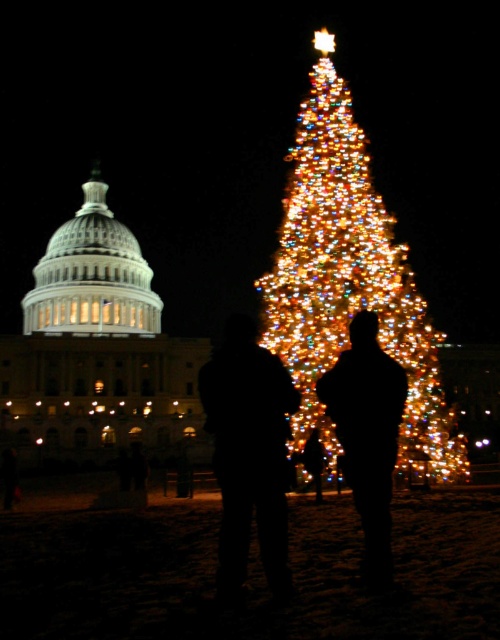
How distant is black silhouette at center from black matte figure at center?

They are 4.24 meters apart.

Does point (243, 531) come closer to viewer compared to point (377, 577)?

No.

Image resolution: width=500 pixels, height=640 pixels. In order to click on black silhouette at center in this screenshot , I will do `click(249, 452)`.

Where is `black silhouette at center`? black silhouette at center is located at coordinates (249, 452).

Consider the image. How far apart are illuminated glass christmas tree at center and black silhouette at center?

A distance of 11.86 meters exists between illuminated glass christmas tree at center and black silhouette at center.

Between illuminated glass christmas tree at center and black silhouette at center, which one has less height?

black silhouette at center

Does point (331, 260) come farther from viewer compared to point (212, 433)?

Yes, point (331, 260) is farther from viewer.

Where is `illuminated glass christmas tree at center`? illuminated glass christmas tree at center is located at coordinates (350, 282).

Between point (416, 428) and point (362, 314), which one is positioned behind?

Positioned behind is point (416, 428).

Can you confirm if illuminated glass christmas tree at center is positioned to the right of black matte figure at center?

In fact, illuminated glass christmas tree at center is to the left of black matte figure at center.

Who is more distant from viewer, (317, 365) or (362, 339)?

Positioned behind is point (317, 365).

The image size is (500, 640). Identify the location of illuminated glass christmas tree at center. (350, 282).